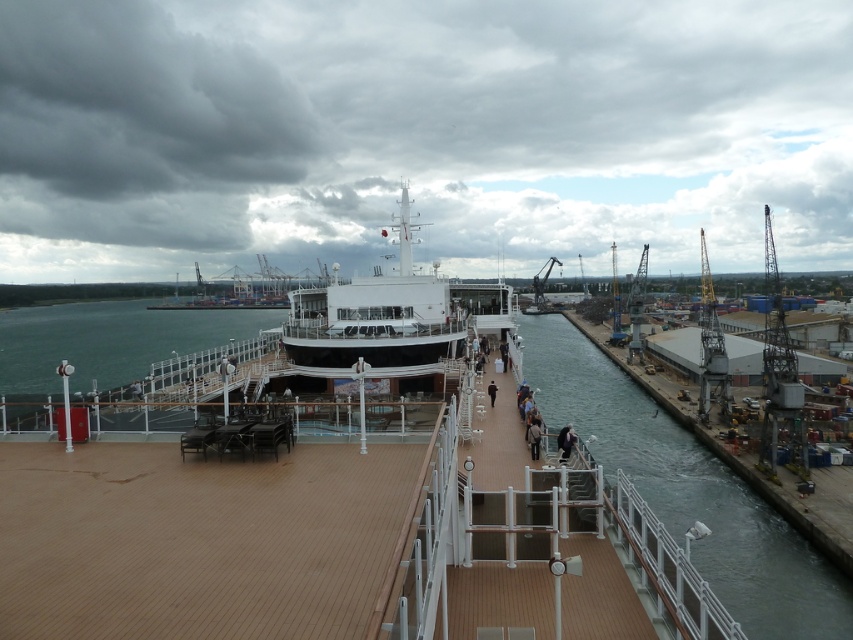
Question: Is clear water at dock right below dark brown leather jacket at center?

Choices:
 (A) no
 (B) yes

Answer: (B)

Question: Is clear water at dock right positioned behind brown leather jacket at center?

Choices:
 (A) no
 (B) yes

Answer: (A)

Question: Based on their relative distances, which object is farther from the brown leather jacket at center?

Choices:
 (A) dark blue fabric jacket at center
 (B) dark brown leather jacket at center

Answer: (A)

Question: Which point is farther from the camera taking this photo?

Choices:
 (A) click(x=564, y=433)
 (B) click(x=531, y=448)
 (C) click(x=786, y=598)
 (D) click(x=490, y=397)

Answer: (D)

Question: Does dark blue fabric jacket at center appear on the right side of brown leather jacket at center?

Choices:
 (A) yes
 (B) no

Answer: (A)

Question: Among these objects, which one is nearest to the camera?

Choices:
 (A) brown leather jacket at center
 (B) dark blue fabric jacket at center
 (C) clear water at dock right
 (D) dark brown leather jacket at center

Answer: (C)